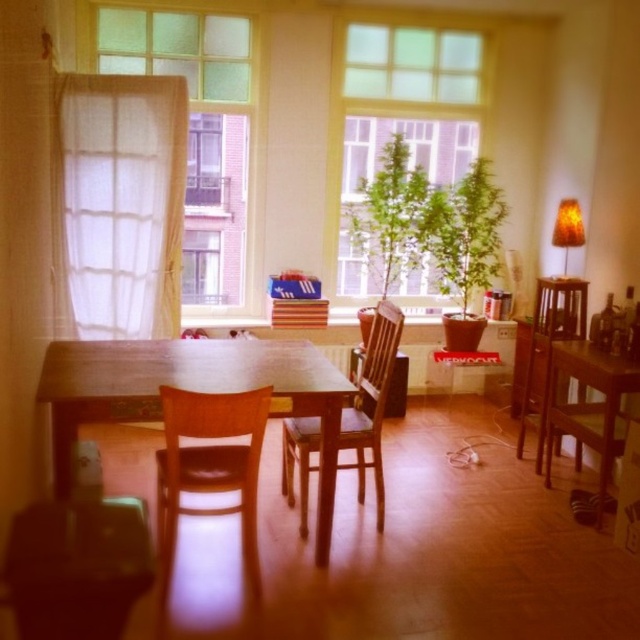
Does wooden chair at center appear over wooden table at right?

Yes.

Between point (342, 412) and point (612, 436), which one is positioned behind?

The point (342, 412) is more distant.

Does point (285, 448) come in front of point (596, 492)?

That is True.

This screenshot has height=640, width=640. Find the location of `wooden chair at center`. wooden chair at center is located at coordinates (371, 401).

Is green leafy plant at center positioned before transparent glass window at center?

That is True.

I want to click on green leafy plant at center, so tap(397, 122).

Is point (433, 173) behind point (220, 296)?

Yes.

Locate an element on the screen. The height and width of the screenshot is (640, 640). green leafy plant at center is located at coordinates (397, 122).

Is translucent glass window at upper left thinner than wooden table at right?

No.

Is translucent glass window at upper left to the right of wooden table at right from the viewer's perspective?

In fact, translucent glass window at upper left is to the left of wooden table at right.

The width and height of the screenshot is (640, 640). Find the location of `translucent glass window at upper left`. translucent glass window at upper left is located at coordinates (204, 138).